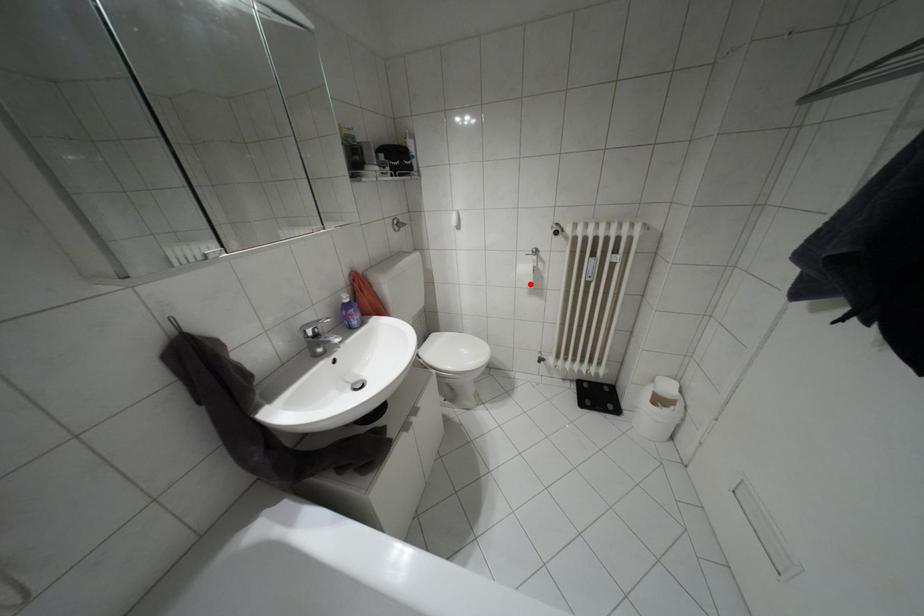
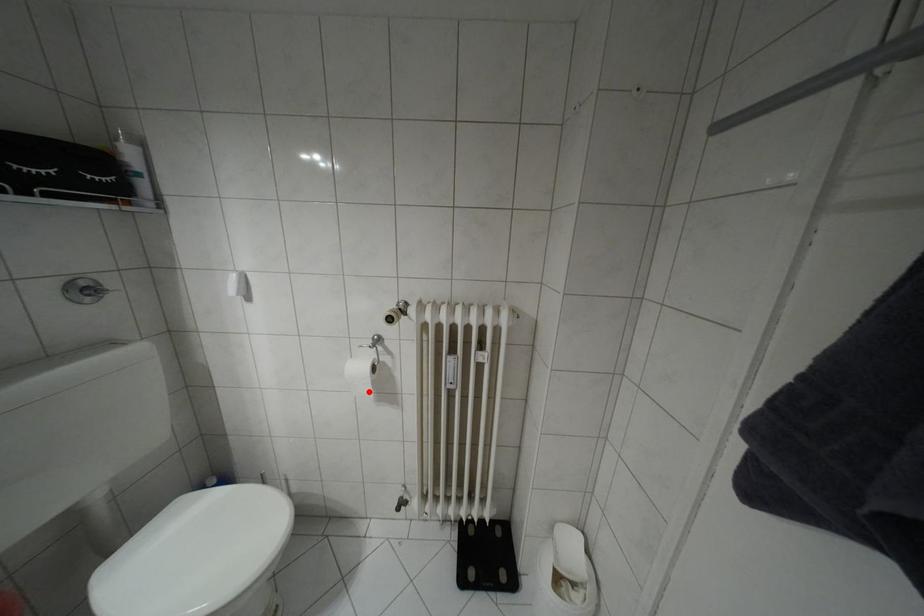
I am providing you with two images of the same scene from different viewpoints. A red point is marked on the first image and another point is marked on the second image. Is the marked point in image1 the same physical position as the marked point in image2?

Yes